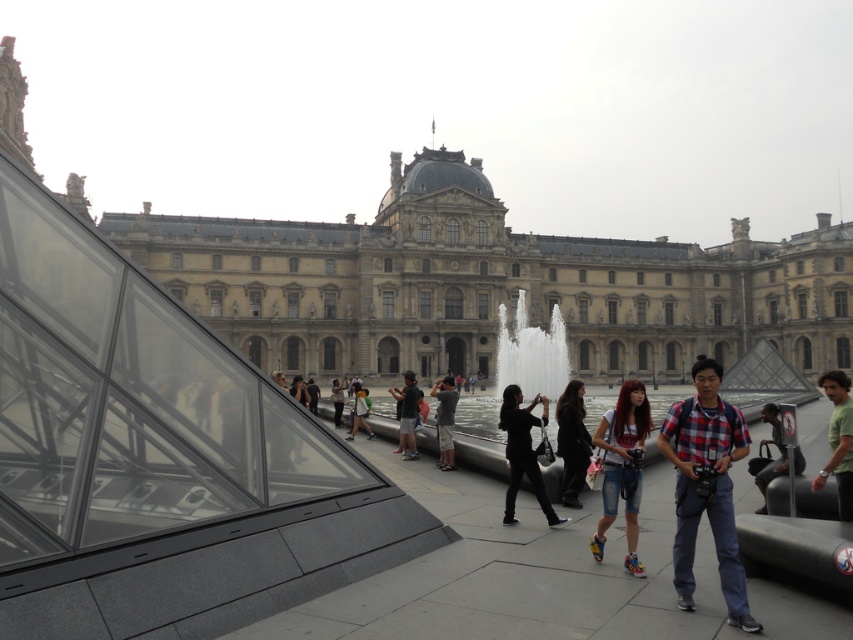
Question: Which point appears farthest from the camera in this image?

Choices:
 (A) (763, 481)
 (B) (500, 228)

Answer: (B)

Question: Is denim shorts at center smaller than matte black shirt at center?

Choices:
 (A) yes
 (B) no

Answer: (B)

Question: Does plaid shirt at center have a lesser width compared to dark gray pants at center?

Choices:
 (A) no
 (B) yes

Answer: (A)

Question: Which point is closer to the camera?

Choices:
 (A) plaid shirt at center
 (B) white marble fountain at center

Answer: (A)

Question: Which point is farther from the camera taking this photo?

Choices:
 (A) (433, 396)
 (B) (544, 273)

Answer: (B)

Question: From the image, what is the correct spatial relationship of dark brown leather jacket at center in relation to dark gray pants at center?

Choices:
 (A) right
 (B) left

Answer: (A)